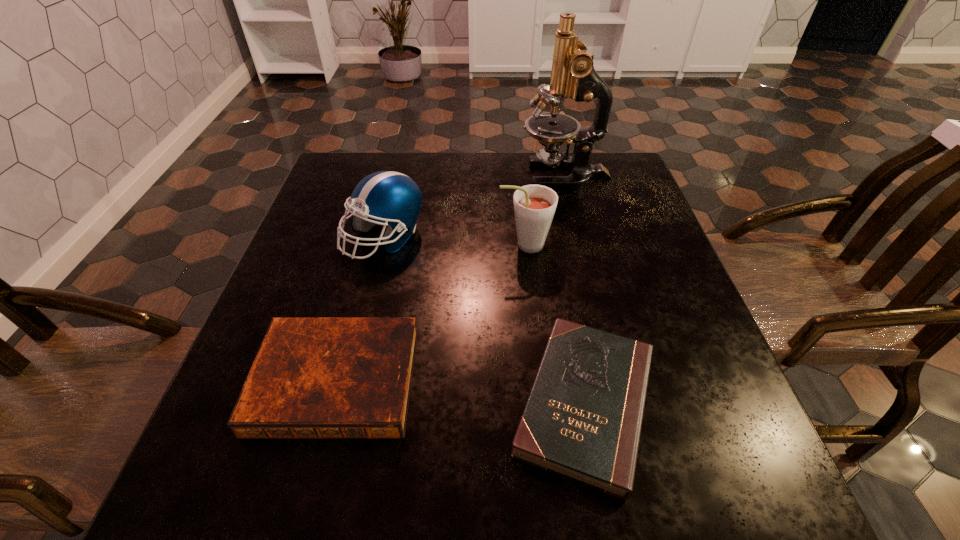
The height and width of the screenshot is (540, 960). I want to click on Bible positioned at the right edge, so click(582, 420).

Find the location of `object located in the far right corner section of the desktop`. object located in the far right corner section of the desktop is located at coordinates (573, 75).

The width and height of the screenshot is (960, 540). In order to click on object present at the near right corner in this screenshot , I will do `click(582, 420)`.

You are a GUI agent. You are given a task and a screenshot of the screen. Output one action in this format:
    pyautogui.click(x=<x>, y=<y>)
    Task: Click on the vacant space at the far edge of the desktop
    This screenshot has width=960, height=540.
    Given the screenshot: What is the action you would take?
    pyautogui.click(x=539, y=171)

Identify the location of blank space at the left edge. (227, 396).

This screenshot has height=540, width=960. I want to click on vacant space at the right edge, so click(743, 431).

In the image, there is a desktop. Identify the location of vacant space at the far right corner. (636, 194).

Find the location of `free space at the near right corner of the desktop`. free space at the near right corner of the desktop is located at coordinates (769, 506).

Find the location of a particular element. This screenshot has height=540, width=960. free space between the football helmet and the root beer is located at coordinates (454, 241).

I want to click on unoccupied position between the microscope and the right Bible, so click(575, 289).